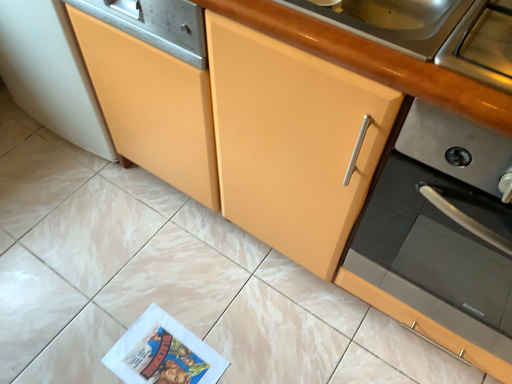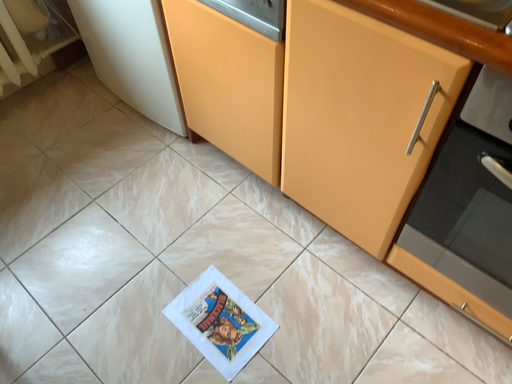
Question: How did the camera likely rotate when shooting the video?

Choices:
 (A) rotated right
 (B) rotated left

Answer: (B)